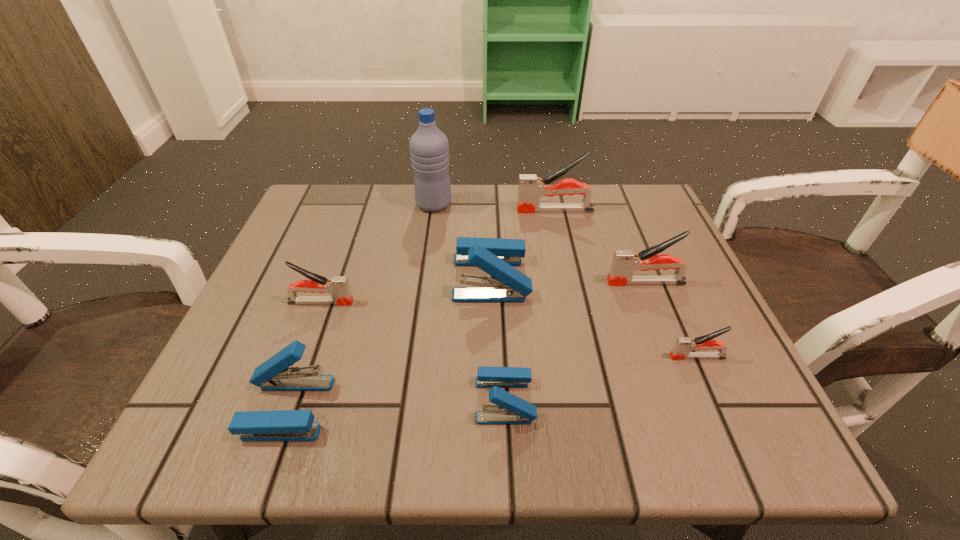
Locate an element on the screen. vacant space located 0.390m on the handle side of the leftmost gray stapler is located at coordinates (561, 302).

Where is `free location located 0.210m on the right of the second smallest blue stapler`? This screenshot has height=540, width=960. free location located 0.210m on the right of the second smallest blue stapler is located at coordinates (466, 407).

Identify the location of vacant space located 0.350m on the handle side of the sixth farthest object. The image size is (960, 540). (461, 357).

Locate an element on the screen. Image resolution: width=960 pixels, height=540 pixels. vacant area located 0.310m on the handle side of the sixth farthest object is located at coordinates (485, 357).

Image resolution: width=960 pixels, height=540 pixels. I want to click on vacant space located on the handle side of the sixth farthest object, so click(x=533, y=357).

Locate an element on the screen. vacant space situated 0.050m on the right of the smallest blue stapler is located at coordinates (566, 400).

The width and height of the screenshot is (960, 540). I want to click on water bottle located in the far edge section of the desktop, so click(x=429, y=148).

Locate an element on the screen. The image size is (960, 540). stapler that is at the far edge is located at coordinates (531, 188).

The image size is (960, 540). I want to click on object located at the near left corner, so click(273, 375).

At what (x,y) coordinates should I click in order to perform the action: click on object that is positioned at the far right corner. Please return your answer as a coordinate pair (x, y). The image size is (960, 540). Looking at the image, I should click on (531, 188).